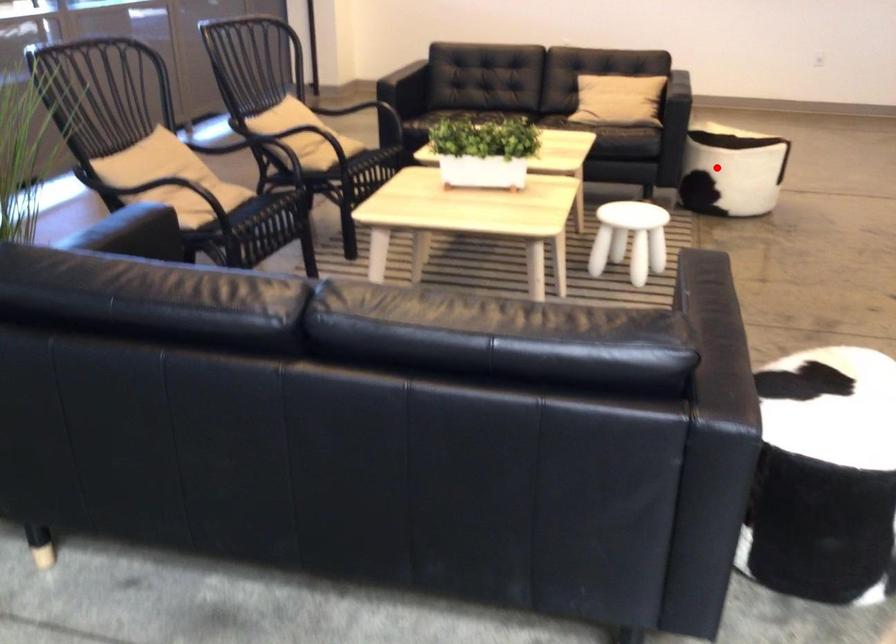
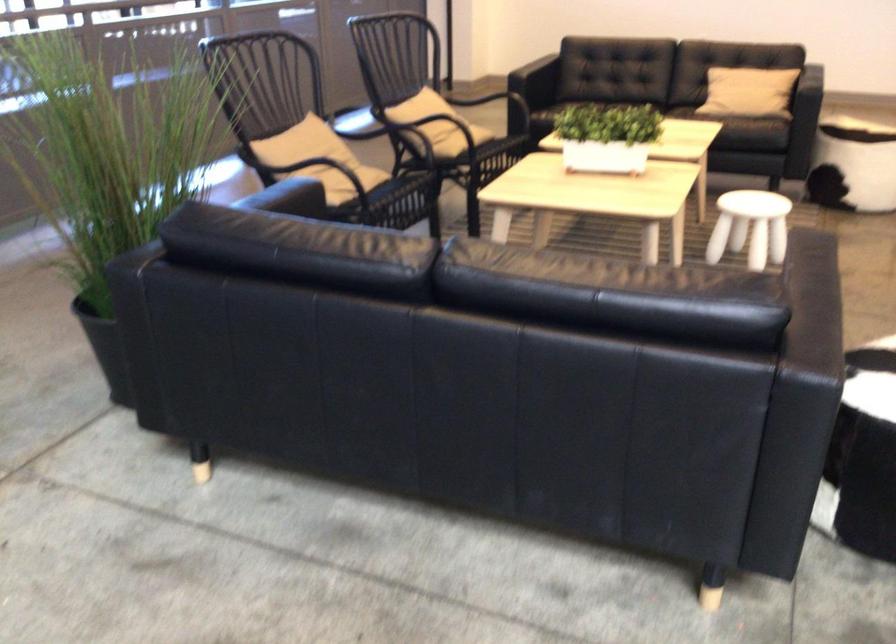
The point at the highlighted location is marked in the first image. Where is the corresponding point in the second image?

(854, 161)